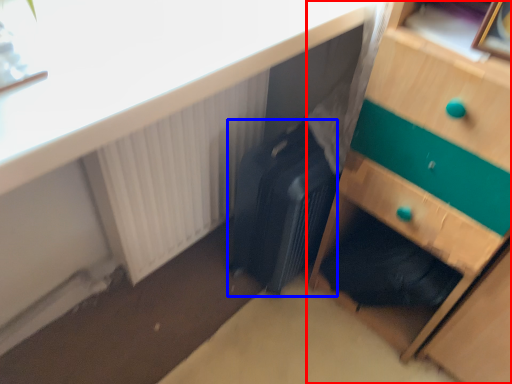
Question: Which object is closer to the camera taking this photo, chest of drawers (highlighted by a red box) or luggage (highlighted by a blue box)?

Choices:
 (A) chest of drawers
 (B) luggage

Answer: (A)